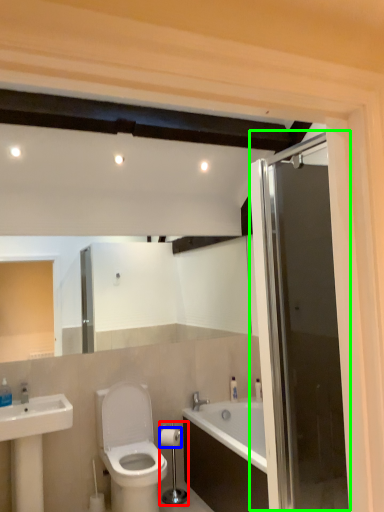
Question: Which object is positioned closest to towel bar (highlighted by a red box)? Select from toilet paper (highlighted by a blue box) and door (highlighted by a green box).

Choices:
 (A) toilet paper
 (B) door

Answer: (A)